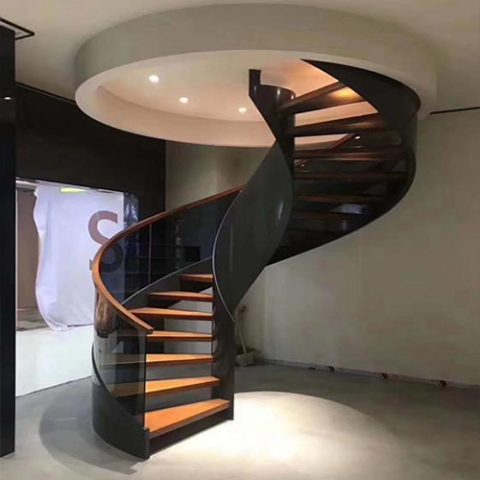
Image resolution: width=480 pixels, height=480 pixels. I want to click on stairwell, so click(x=235, y=257).